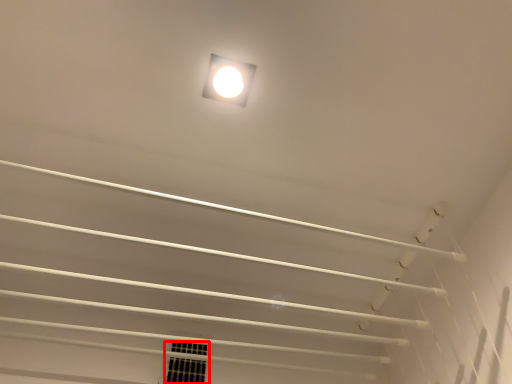
Question: In this image, where is window (annotated by the red box) located relative to lamp?

Choices:
 (A) right
 (B) left

Answer: (B)